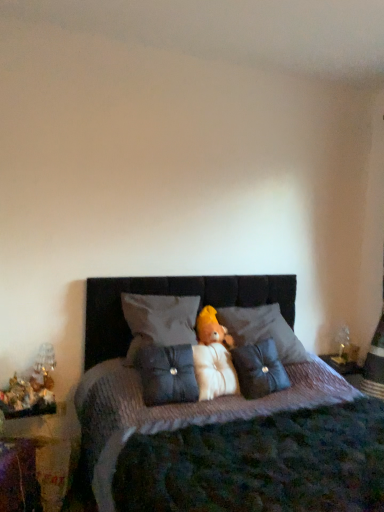
Question: From the image's perspective, is velvet dark brown bed at center beneath suede-like dark blue pillow at center, the second pillow from the left?

Choices:
 (A) no
 (B) yes

Answer: (B)

Question: Is there a large distance between velvet dark brown bed at center and suede-like dark blue pillow at center, the second pillow from the left?

Choices:
 (A) yes
 (B) no

Answer: (B)

Question: Can you confirm if velvet dark brown bed at center is shorter than suede-like dark blue pillow at center, the 2th pillow viewed from the right?

Choices:
 (A) yes
 (B) no

Answer: (B)

Question: Can you confirm if velvet dark brown bed at center is smaller than suede-like dark blue pillow at center, the second pillow from the left?

Choices:
 (A) yes
 (B) no

Answer: (B)

Question: Is velvet dark brown bed at center next to suede-like dark blue pillow at center, the 2th pillow viewed from the right, and touching it?

Choices:
 (A) no
 (B) yes

Answer: (A)

Question: Based on their sizes in the image, would you say velvet dark brown bed at center is bigger or smaller than gray fabric pillow at center, which is counted as the first pillow, starting from the left?

Choices:
 (A) small
 (B) big

Answer: (B)

Question: From the image's perspective, is velvet dark brown bed at center located above or below gray fabric pillow at center, which is the 3th pillow from right to left?

Choices:
 (A) above
 (B) below

Answer: (B)

Question: Considering the positions of velvet dark brown bed at center and gray fabric pillow at center, which is the 3th pillow from right to left, in the image, is velvet dark brown bed at center wider or thinner than gray fabric pillow at center, which is the 3th pillow from right to left,?

Choices:
 (A) wide
 (B) thin

Answer: (A)

Question: Is velvet dark brown bed at center inside the boundaries of gray fabric pillow at center, which is counted as the first pillow, starting from the left, or outside?

Choices:
 (A) outside
 (B) inside

Answer: (A)

Question: Is suede-like dark blue pillow at center, the second pillow from the left, wider or thinner than velvet dark brown bed at center?

Choices:
 (A) wide
 (B) thin

Answer: (B)

Question: Considering the positions of suede-like dark blue pillow at center, the second pillow from the left, and velvet dark brown bed at center in the image, is suede-like dark blue pillow at center, the second pillow from the left, taller or shorter than velvet dark brown bed at center?

Choices:
 (A) short
 (B) tall

Answer: (A)

Question: Is suede-like dark blue pillow at center, the second pillow from the left, in front of or behind velvet dark brown bed at center in the image?

Choices:
 (A) front
 (B) behind

Answer: (B)

Question: In the image, is suede-like dark blue pillow at center, the second pillow from the left, on the left side or the right side of velvet dark brown bed at center?

Choices:
 (A) right
 (B) left

Answer: (B)

Question: In the image, is velvet dark brown bed at center positioned in front of or behind velvet plush bear at center?

Choices:
 (A) front
 (B) behind

Answer: (A)

Question: In terms of size, does velvet dark brown bed at center appear bigger or smaller than velvet plush bear at center?

Choices:
 (A) small
 (B) big

Answer: (B)